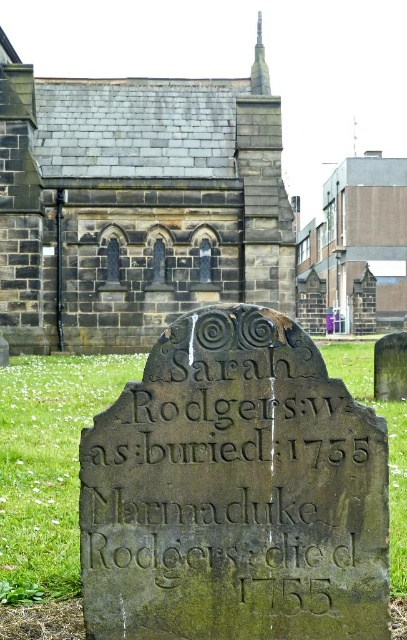
You are standing at the point closest to the gravestone in the image. There are two points marked in the scene, one at coordinates point (135,275) and another at point (262,42). Which point is closer to you?

Point (135,275) is in front of point (262,42), so the point closer to you is point (135,275).

You are standing in front of the gravestone and want to take a photo of the brown stone church at upper center and the smooth gray stone spire at upper center. Which object should you focus on first to ensure both are in the frame?

You should focus on the brown stone church at upper center first because it is closer to you than the smooth gray stone spire at upper center, ensuring both are in the frame.